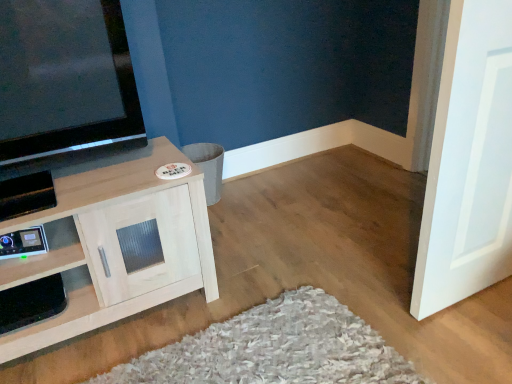
This screenshot has width=512, height=384. Identify the location of free area in between white matte door at right and light wood cabinet at left. (282, 298).